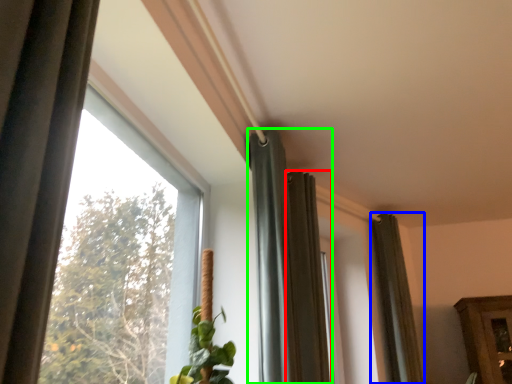
Question: Which is nearer to the curtain (highlighted by a red box)? curtain (highlighted by a blue box) or curtain (highlighted by a green box).

Choices:
 (A) curtain
 (B) curtain

Answer: (B)